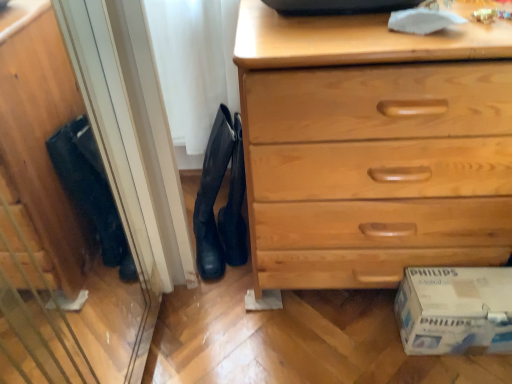
What are the coordinates of `vacant area in front of black suede boot at center` in the screenshot? It's located at click(215, 304).